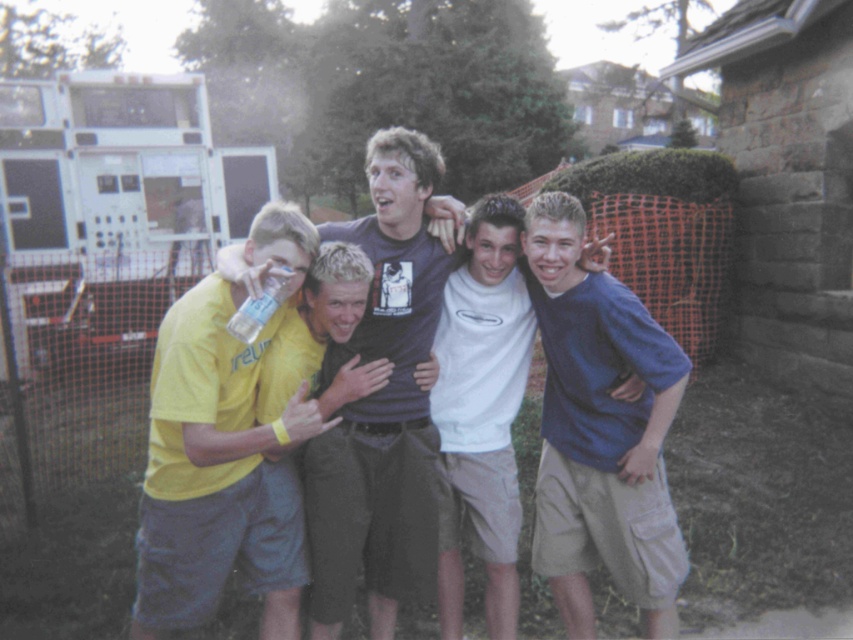
Please provide the coordinates of the blue cotton shirt at center in the image. The coordinate system is normalized, with the origin at the bottom left corner of the image. The x and y axes are measured in meters.

The blue cotton shirt at center is located at coordinates point (601,432).